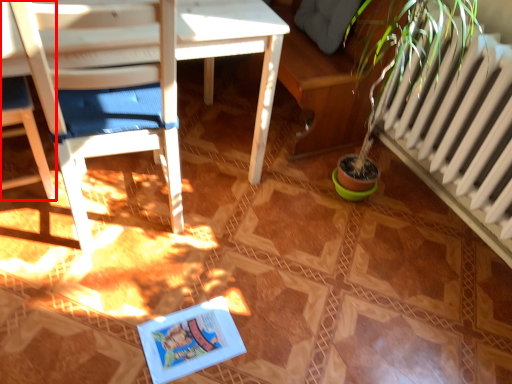
Question: From the image's perspective, where is chair (annotated by the red box) located relative to chair?

Choices:
 (A) below
 (B) above

Answer: (B)